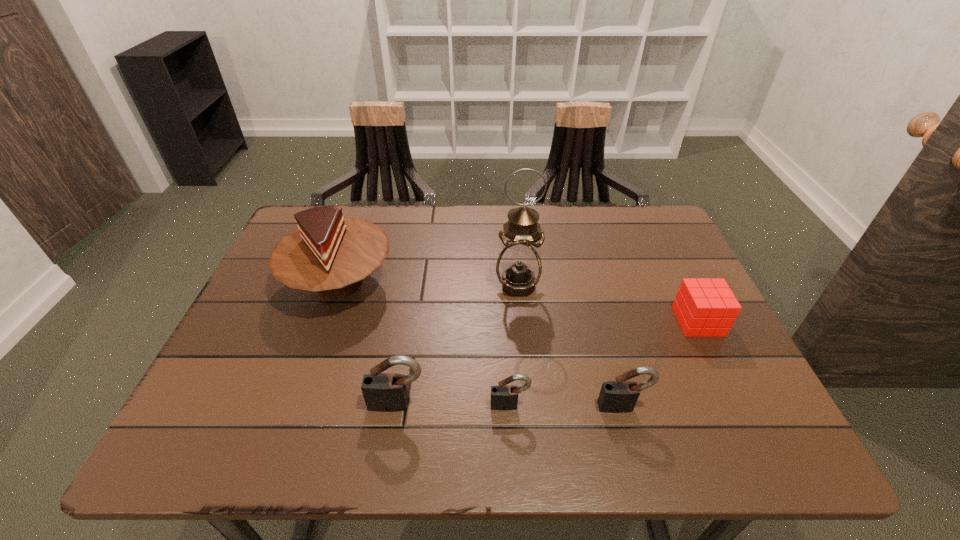
Identify the location of free space between the leftmost padlock and the rightmost object. (548, 363).

Select which object appears as the closest to the cube. Please provide its 2D coordinates. Your answer should be formatted as a tuple, i.e. [(x, y)], where the tuple contains the x and y coordinates of a point satisfying the conditions above.

[(620, 396)]

Select which object is the third closest to the second tallest object. Please provide its 2D coordinates. Your answer should be formatted as a tuple, i.e. [(x, y)], where the tuple contains the x and y coordinates of a point satisfying the conditions above.

[(504, 397)]

Locate an element on the screen. padlock that is the third nearest to the cube is located at coordinates (383, 392).

In order to click on padlock that is the closest one to the second tallest object in this screenshot , I will do `click(383, 392)`.

Locate an element on the screen. The width and height of the screenshot is (960, 540). vacant position in the image that satisfies the following two spatial constraints: 1. on the front side of the tallest object; 2. on the right side of the rightmost object is located at coordinates (521, 322).